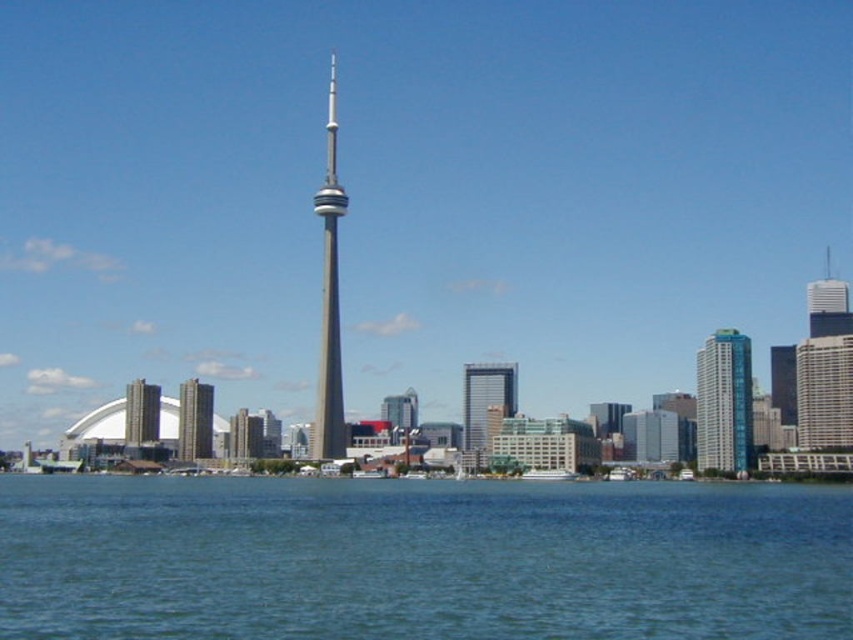
Question: Does silver metallic tower at center have a greater width compared to brown textured building at center?

Choices:
 (A) yes
 (B) no

Answer: (A)

Question: Is blue glass building at right behind silver metallic tower at center?

Choices:
 (A) yes
 (B) no

Answer: (B)

Question: Which object is the farthest from the glassy reflective skyscraper at center?

Choices:
 (A) blue glass building at right
 (B) silver metallic tower at center
 (C) brown textured building at center
 (D) blue liquid water at lower center

Answer: (D)

Question: Which point is farther from the camera taking this photo?

Choices:
 (A) (138, 440)
 (B) (180, 426)
 (C) (339, 198)

Answer: (C)

Question: Is blue glass building at right bigger than silver metallic tower at center?

Choices:
 (A) no
 (B) yes

Answer: (A)

Question: Which of the following is the closest to the observer?

Choices:
 (A) (730, 385)
 (B) (132, 404)
 (C) (523, 579)
 (D) (486, 372)

Answer: (C)